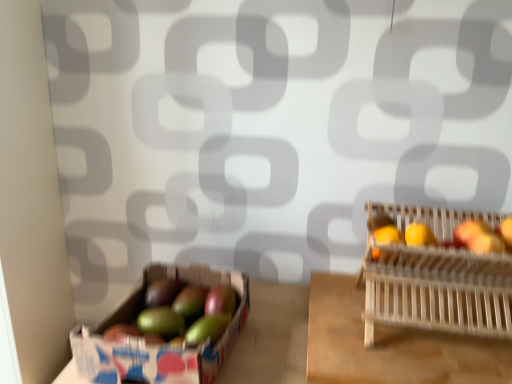
Question: From the image's perspective, is shiny red apple at right, placed as the first apple when sorted from right to left, located beneath green matte mango at lower left, which ranks as the 4th apple in right-to-left order?

Choices:
 (A) no
 (B) yes

Answer: (A)

Question: Are shiny red apple at right, placed as the first apple when sorted from right to left, and green matte mango at lower left, which ranks as the 4th apple in right-to-left order, located far from each other?

Choices:
 (A) yes
 (B) no

Answer: (B)

Question: Is green matte mango at lower left, positioned as the second apple in left-to-right order, located within shiny red apple at right, the fifth apple viewed from the left?

Choices:
 (A) no
 (B) yes

Answer: (A)

Question: Does shiny red apple at right, placed as the first apple when sorted from right to left, appear on the left side of green matte mango at lower left, which ranks as the 4th apple in right-to-left order?

Choices:
 (A) yes
 (B) no

Answer: (B)

Question: Does shiny red apple at right, the fifth apple viewed from the left, have a larger size compared to green matte mango at lower left, which ranks as the 4th apple in right-to-left order?

Choices:
 (A) no
 (B) yes

Answer: (A)

Question: Can you confirm if shiny red apple at right, the fifth apple viewed from the left, is shorter than green matte mango at lower left, which ranks as the 4th apple in right-to-left order?

Choices:
 (A) yes
 (B) no

Answer: (A)

Question: Is green matte avocado at lower left, arranged as the first apple when viewed from the left, not inside green matte mangoes at left?

Choices:
 (A) no
 (B) yes

Answer: (A)

Question: Considering the relative positions of green matte avocado at lower left, arranged as the first apple when viewed from the left, and green matte mangoes at left in the image provided, is green matte avocado at lower left, arranged as the first apple when viewed from the left, to the right of green matte mangoes at left from the viewer's perspective?

Choices:
 (A) no
 (B) yes

Answer: (A)

Question: Is there a large distance between green matte avocado at lower left, arranged as the 5th apple when viewed from the right, and green matte mangoes at left?

Choices:
 (A) no
 (B) yes

Answer: (A)

Question: Does green matte avocado at lower left, arranged as the 5th apple when viewed from the right, come in front of green matte mangoes at left?

Choices:
 (A) yes
 (B) no

Answer: (B)

Question: Is green matte avocado at lower left, arranged as the first apple when viewed from the left, taller than green matte mangoes at left?

Choices:
 (A) no
 (B) yes

Answer: (A)

Question: Is green matte avocado at lower left, arranged as the 5th apple when viewed from the right, further to camera compared to green matte mangoes at left?

Choices:
 (A) yes
 (B) no

Answer: (A)

Question: Is wooden slatted basket at right oriented away from green matte apple at center, arranged as the third apple when viewed from the left?

Choices:
 (A) yes
 (B) no

Answer: (B)